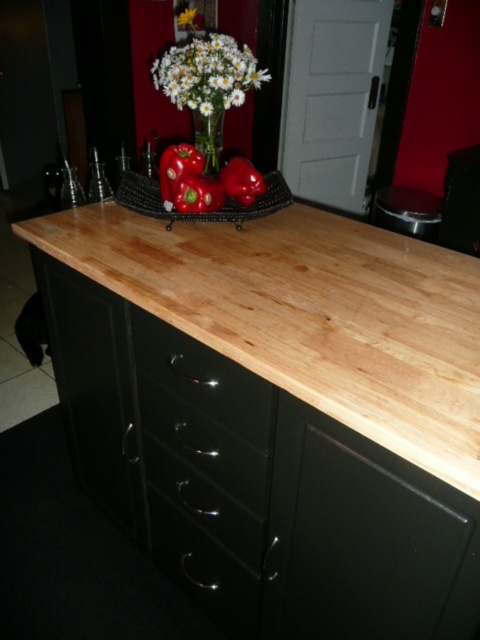
Is point (248, 204) more distant than point (203, 120)?

Yes, it is behind point (203, 120).

Between point (251, 172) and point (210, 156), which one is positioned in front?

Point (251, 172)

Locate an element on the screen. Image resolution: width=480 pixels, height=640 pixels. glossy red bell pepper at center is located at coordinates (241, 180).

Is point (164, 148) closer to viewer compared to point (183, 22)?

No, (164, 148) is behind (183, 22).

Where is `red glossy bell pepper at center`? The image size is (480, 640). red glossy bell pepper at center is located at coordinates (177, 170).

Locate an element on the screen. This screenshot has height=640, width=480. red glossy bell pepper at center is located at coordinates (177, 170).

Which of these two, natural wood counter at center or red glossy bell pepper at center, stands shorter?

Standing shorter between the two is red glossy bell pepper at center.

Does point (427, 595) come in front of point (164, 192)?

Yes, it is in front of point (164, 192).

I want to click on natural wood counter at center, so click(276, 412).